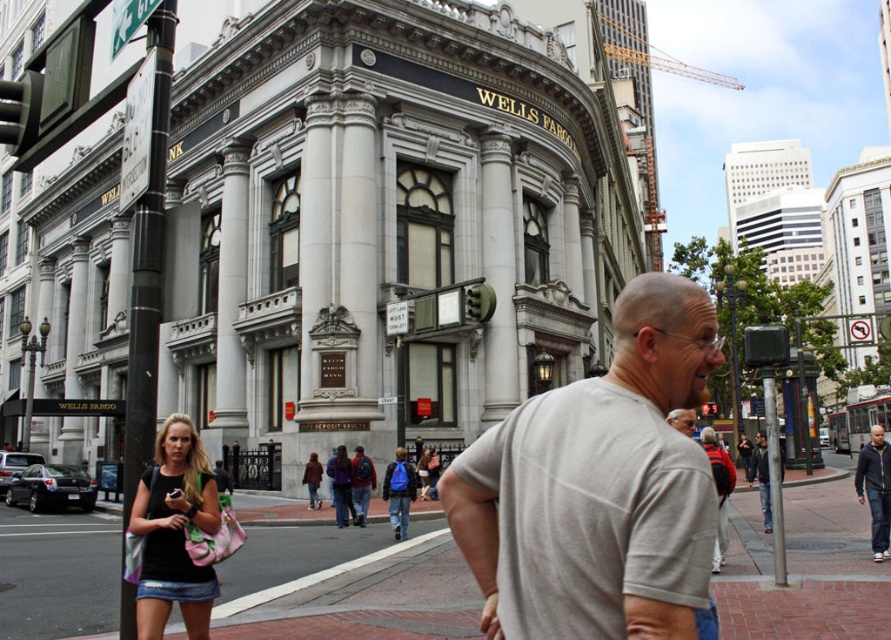
Question: Is dark blue jacket at right to the left of purple fabric backpack at center from the viewer's perspective?

Choices:
 (A) yes
 (B) no

Answer: (B)

Question: Which object appears farthest from the camera in this image?

Choices:
 (A) purple fabric backpack at center
 (B) brick pavement at center

Answer: (A)

Question: Which object appears farthest from the camera in this image?

Choices:
 (A) purple fabric backpack at center
 (B) dark blue jacket at right

Answer: (A)

Question: Which point appears farthest from the camera in this image?

Choices:
 (A) (648, 536)
 (B) (184, 600)
 (C) (857, 497)

Answer: (C)

Question: In this image, where is brick pavement at center located relative to dark blue jacket at right?

Choices:
 (A) below
 (B) above

Answer: (A)

Question: Is black denim shorts at lower left further to camera compared to purple fabric backpack at center?

Choices:
 (A) yes
 (B) no

Answer: (B)